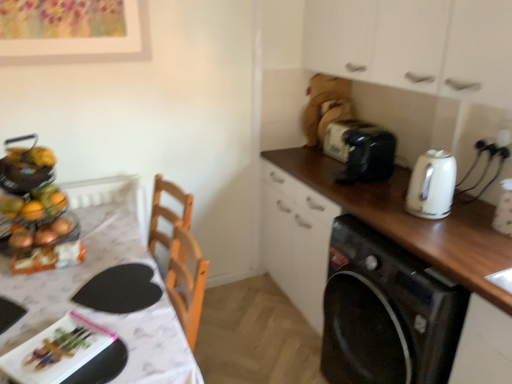
Question: Considering the positions of white glossy table at left and metallic fruit basket at left in the image, is white glossy table at left taller or shorter than metallic fruit basket at left?

Choices:
 (A) short
 (B) tall

Answer: (B)

Question: Would you say white glossy table at left is to the left or to the right of metallic fruit basket at left in the picture?

Choices:
 (A) left
 (B) right

Answer: (B)

Question: Which object is positioned closest to the white glossy table at left?

Choices:
 (A) black glossy washing machine at right
 (B) white matte cabinet at upper right
 (C) white glossy electric kettle at right
 (D) black plastic toaster at upper right
 (E) metallic fruit basket at left

Answer: (E)

Question: Which object is the closest to the metallic fruit basket at left?

Choices:
 (A) black plastic toaster at upper right
 (B) white glossy table at left
 (C) black plastic toaster at upper right
 (D) white matte cabinet at upper right
 (E) white glossy electric kettle at right

Answer: (B)